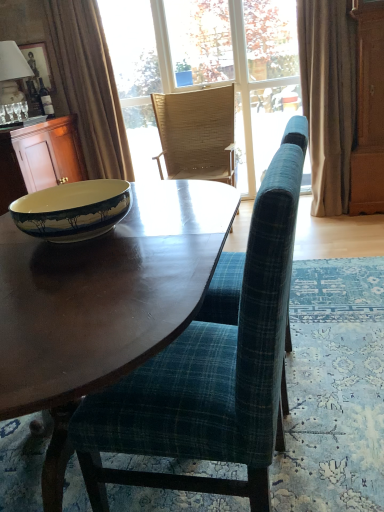
The image size is (384, 512). What are the coordinates of `vacant space to the right of matte ceramic bowl at left` in the screenshot? It's located at (179, 218).